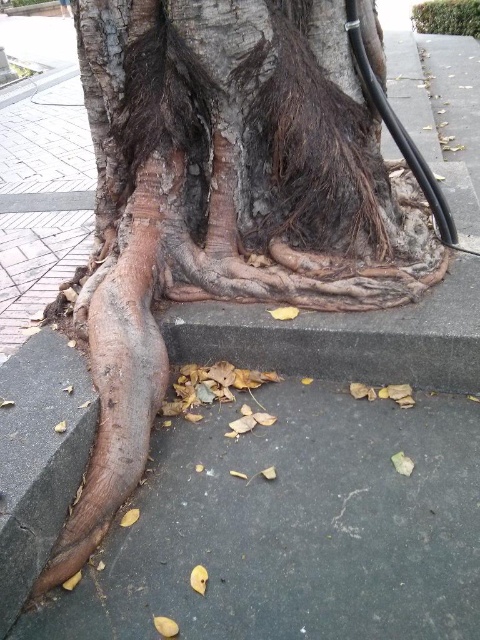
Does brown rough pavement at lower left have a lesser width compared to brown rough bark at center?

No.

Is brown rough pavement at lower left above brown rough bark at center?

Actually, brown rough pavement at lower left is below brown rough bark at center.

Locate an element on the screen. brown rough pavement at lower left is located at coordinates (254, 516).

You are a GUI agent. You are given a task and a screenshot of the screen. Output one action in this format:
    pyautogui.click(x=<x>, y=<y>)
    Task: Click on the brown rough pavement at lower left
    The image size is (480, 640).
    Given the screenshot: What is the action you would take?
    pyautogui.click(x=254, y=516)